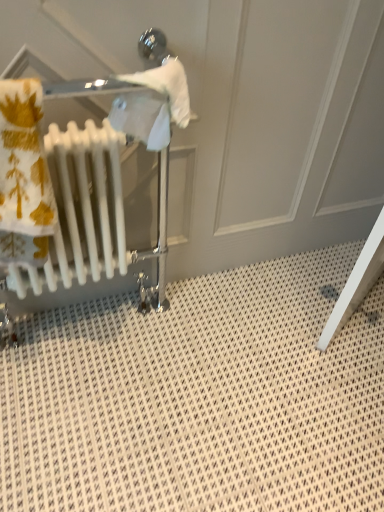
Question: Would you say white glossy radiator at left is inside or outside white plastic radiator at left?

Choices:
 (A) outside
 (B) inside

Answer: (A)

Question: Visually, is white glossy radiator at left positioned to the left or to the right of white plastic radiator at left?

Choices:
 (A) right
 (B) left

Answer: (A)

Question: Considering the positions of white glossy radiator at left and white plastic radiator at left in the image, is white glossy radiator at left bigger or smaller than white plastic radiator at left?

Choices:
 (A) big
 (B) small

Answer: (A)

Question: Visually, is white plastic radiator at left positioned to the left or to the right of white glossy radiator at left?

Choices:
 (A) left
 (B) right

Answer: (A)

Question: In terms of height, does white plastic radiator at left look taller or shorter compared to white glossy radiator at left?

Choices:
 (A) short
 (B) tall

Answer: (A)

Question: Is point (84, 178) closer or farther from the camera than point (120, 201)?

Choices:
 (A) closer
 (B) farther

Answer: (A)

Question: From the image's perspective, is white plastic radiator at left located above or below white glossy radiator at left?

Choices:
 (A) above
 (B) below

Answer: (A)